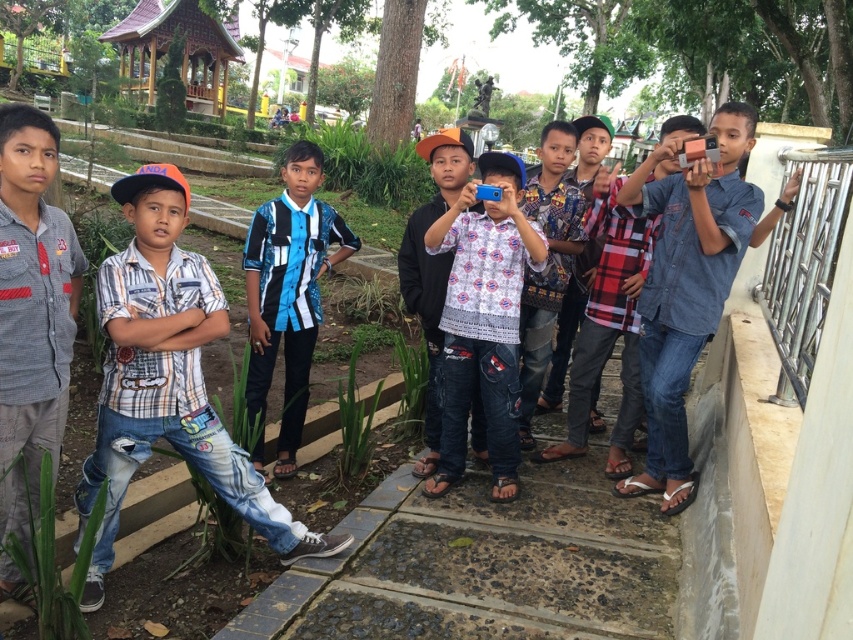
Looking at this image, is gray cotton shirt at left above blue and white striped shirt at center?

Actually, gray cotton shirt at left is below blue and white striped shirt at center.

Is point (33, 132) farther from viewer compared to point (302, 252)?

No, (33, 132) is closer to viewer.

In order to click on gray cotton shirt at left in this screenshot , I will do `click(32, 310)`.

Which is below, checkered denim jeans at center or denim jeans at right?

checkered denim jeans at center is below.

Does point (83, 604) lie behind point (642, 294)?

No, (83, 604) is closer to viewer.

You are a GUI agent. You are given a task and a screenshot of the screen. Output one action in this format:
    pyautogui.click(x=<x>, y=<y>)
    Task: Click on the checkered denim jeans at center
    
    Given the screenshot: What is the action you would take?
    pyautogui.click(x=167, y=378)

Who is positioned more to the left, checkered denim jeans at center or blue and white striped shirt at center?

Positioned to the left is checkered denim jeans at center.

What do you see at coordinates (167, 378) in the screenshot? The height and width of the screenshot is (640, 853). I see `checkered denim jeans at center` at bounding box center [167, 378].

What do you see at coordinates (167, 378) in the screenshot? I see `checkered denim jeans at center` at bounding box center [167, 378].

Where is `checkered denim jeans at center`? Image resolution: width=853 pixels, height=640 pixels. checkered denim jeans at center is located at coordinates (167, 378).